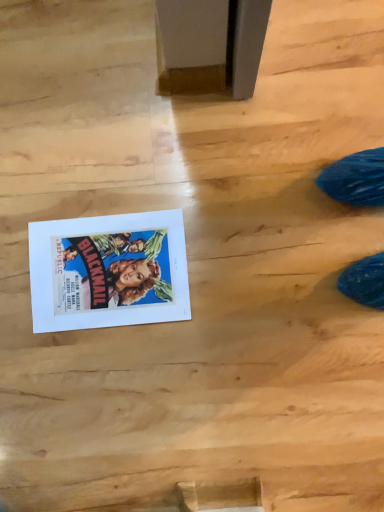
Locate an element on the screen. The image size is (384, 512). blank space above matte paper poster at lower left (from a real-world perspective) is located at coordinates pos(108,264).